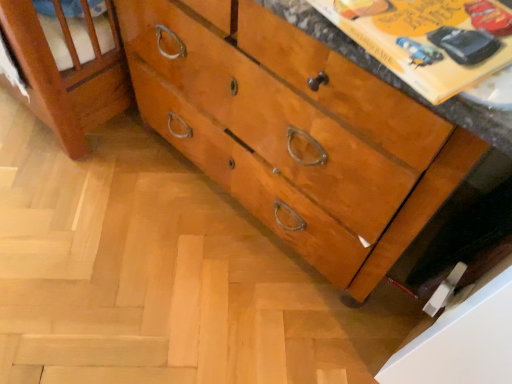
Question: In terms of height, does yellow paper at upper right look taller or shorter compared to shiny wood chest of drawers at center?

Choices:
 (A) short
 (B) tall

Answer: (A)

Question: Is yellow paper at upper right situated inside shiny wood chest of drawers at center or outside?

Choices:
 (A) outside
 (B) inside

Answer: (A)

Question: From a real-world perspective, is yellow paper at upper right positioned above or below shiny wood chest of drawers at center?

Choices:
 (A) above
 (B) below

Answer: (A)

Question: From a real-world perspective, is shiny wood chest of drawers at center above or below yellow paper at upper right?

Choices:
 (A) above
 (B) below

Answer: (B)

Question: In the image, is shiny wood chest of drawers at center on the left side or the right side of yellow paper at upper right?

Choices:
 (A) right
 (B) left

Answer: (B)

Question: In terms of height, does shiny wood chest of drawers at center look taller or shorter compared to yellow paper at upper right?

Choices:
 (A) short
 (B) tall

Answer: (B)

Question: From the image's perspective, is shiny wood chest of drawers at center located above or below yellow paper at upper right?

Choices:
 (A) below
 (B) above

Answer: (B)